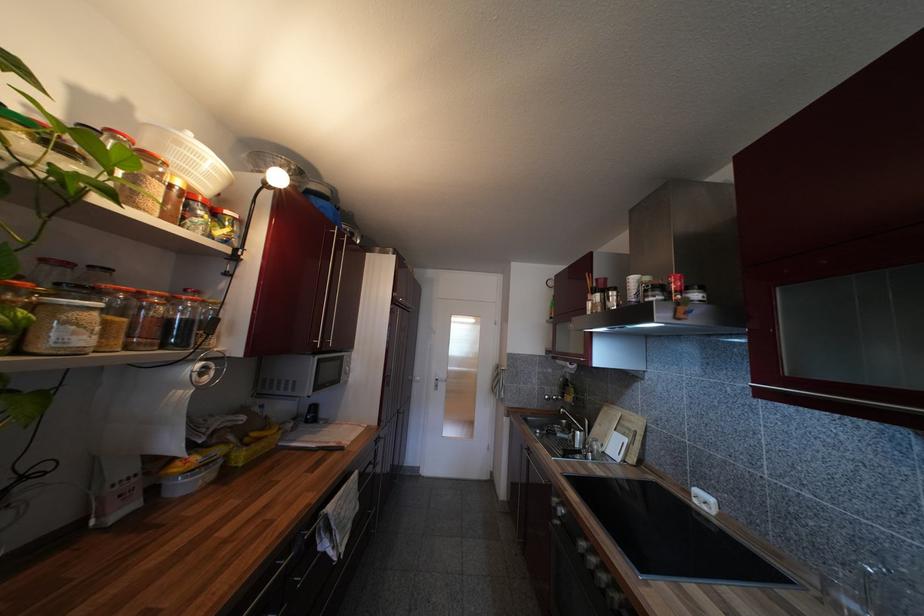
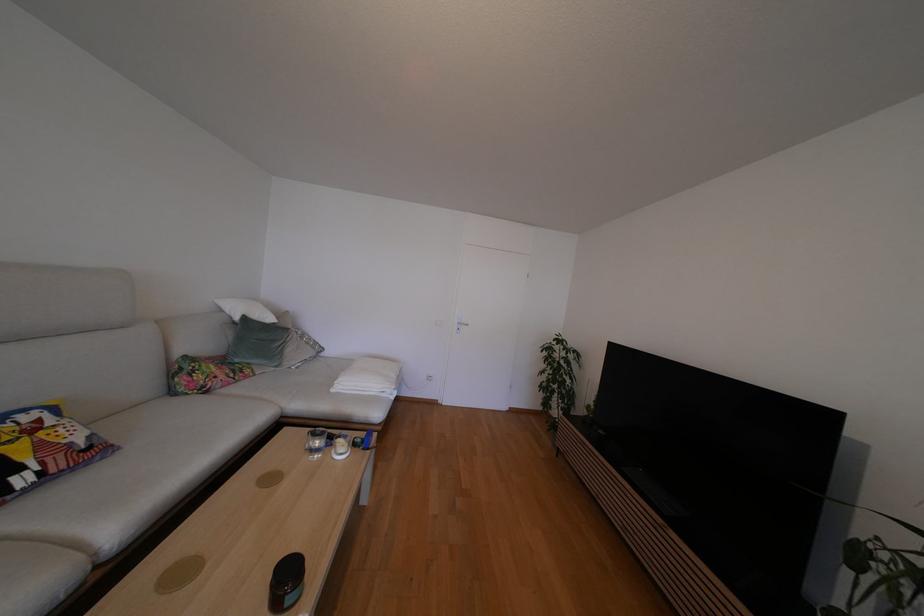
Question: What movement of the cameraman would produce the second image?

Choices:
 (A) Left
 (B) Right
 (C) Forward
 (D) Backward

Answer: (A)